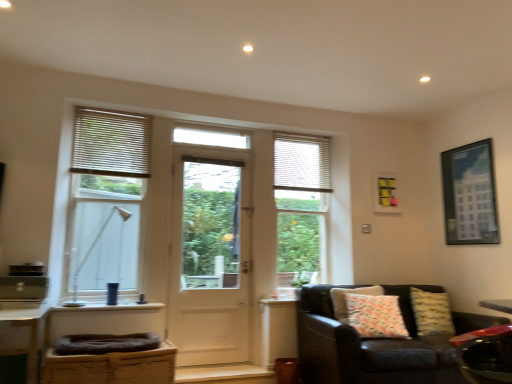
Question: Does leather couch at lower right contain white matte blinds at upper left?

Choices:
 (A) yes
 (B) no

Answer: (B)

Question: Are leather couch at lower right and white matte blinds at upper left beside each other?

Choices:
 (A) yes
 (B) no

Answer: (B)

Question: Is white matte blinds at upper left at the back of leather couch at lower right?

Choices:
 (A) no
 (B) yes

Answer: (A)

Question: Is leather couch at lower right taller than white matte blinds at upper left?

Choices:
 (A) no
 (B) yes

Answer: (B)

Question: Are leather couch at lower right and white matte blinds at upper left located far from each other?

Choices:
 (A) no
 (B) yes

Answer: (B)

Question: Is white matte shutter at upper right taller or shorter than white matte blinds at upper left?

Choices:
 (A) tall
 (B) short

Answer: (A)

Question: Does point (327, 182) appear closer or farther from the camera than point (124, 130)?

Choices:
 (A) farther
 (B) closer

Answer: (A)

Question: Would you say white matte shutter at upper right is to the left or to the right of white matte blinds at upper left in the picture?

Choices:
 (A) right
 (B) left

Answer: (A)

Question: Is white matte shutter at upper right spatially inside white matte blinds at upper left, or outside of it?

Choices:
 (A) inside
 (B) outside

Answer: (B)

Question: Is point (441, 324) closer or farther from the camera than point (136, 130)?

Choices:
 (A) closer
 (B) farther

Answer: (A)

Question: Is yellow textured pillow at lower right, the first pillow positioned from the right, bigger or smaller than wooden blinds at left, the 2th window viewed from the back?

Choices:
 (A) big
 (B) small

Answer: (B)

Question: From a real-world perspective, relative to wooden blinds at left, the third window positioned from the right, is yellow textured pillow at lower right, the 2th pillow when ordered from left to right, vertically above or below?

Choices:
 (A) above
 (B) below

Answer: (B)

Question: Considering the positions of yellow textured pillow at lower right, the 2th pillow when ordered from left to right, and wooden blinds at left, the 2th window viewed from the back, in the image, is yellow textured pillow at lower right, the 2th pillow when ordered from left to right, taller or shorter than wooden blinds at left, the 2th window viewed from the back,?

Choices:
 (A) tall
 (B) short

Answer: (B)

Question: Does point (142, 162) appear closer or farther from the camera than point (139, 369)?

Choices:
 (A) farther
 (B) closer

Answer: (A)

Question: Would you say white matte blinds at upper left is inside or outside brown woven basket at lower left, the second swivel chair in the front-to-back sequence?

Choices:
 (A) outside
 (B) inside

Answer: (A)